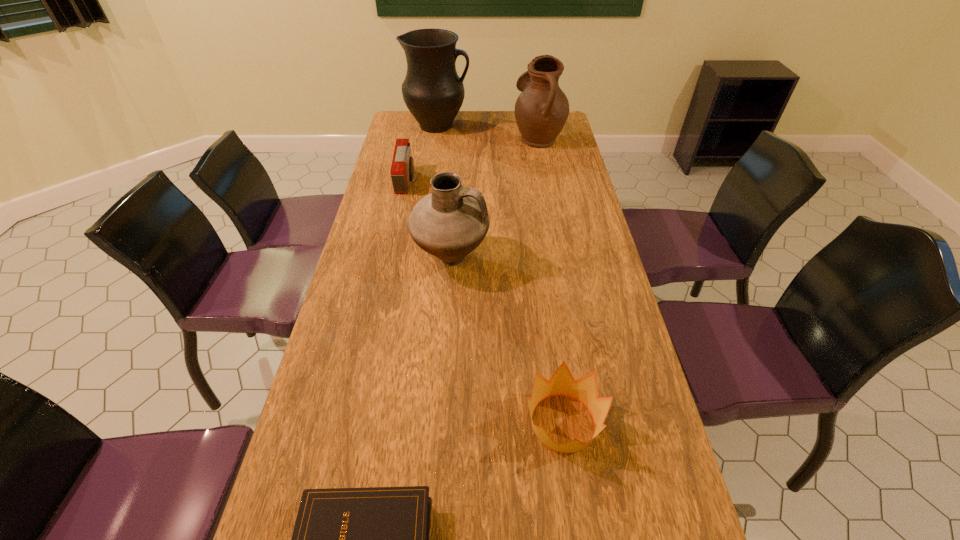
Where is `free space between the second nearest object and the fourth farthest object`? The image size is (960, 540). free space between the second nearest object and the fourth farthest object is located at coordinates (507, 341).

The image size is (960, 540). I want to click on free space that is in between the camera and the rightmost pitcher, so click(472, 160).

Find the location of `vacant space that's between the rightmost pitcher and the shortest pitcher`. vacant space that's between the rightmost pitcher and the shortest pitcher is located at coordinates (494, 198).

Find the location of a particular element. empty space between the camera and the rightmost pitcher is located at coordinates (472, 160).

Locate which object is the second closest to the second nearest object. Please provide its 2D coordinates. Your answer should be formatted as a tuple, i.e. [(x, y)], where the tuple contains the x and y coordinates of a point satisfying the conditions above.

[(452, 221)]

Point out which object is positioned as the fourth nearest to the Bible. Please provide its 2D coordinates. Your answer should be formatted as a tuple, i.e. [(x, y)], where the tuple contains the x and y coordinates of a point satisfying the conditions above.

[(541, 110)]

Find the location of a particular element. The width and height of the screenshot is (960, 540). pitcher that stands as the closest to the crown is located at coordinates (452, 221).

Identify the location of pitcher object that ranks as the closest to the fourth farthest object. (541, 110).

This screenshot has height=540, width=960. What are the coordinates of `blank space that satisfies the following two spatial constraints: 1. on the front-facing side of the third farthest object; 2. on the left side of the crown` in the screenshot? It's located at (355, 423).

Identify the location of free region that satisfies the following two spatial constraints: 1. on the back side of the crown; 2. on the handle side of the third tallest object. (540, 259).